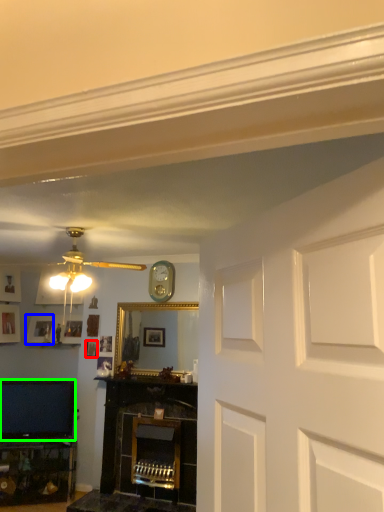
Question: Considering the real-world distances, which object is closest to picture frame (highlighted by a red box)? picture frame (highlighted by a blue box) or television (highlighted by a green box).

Choices:
 (A) picture frame
 (B) television

Answer: (A)